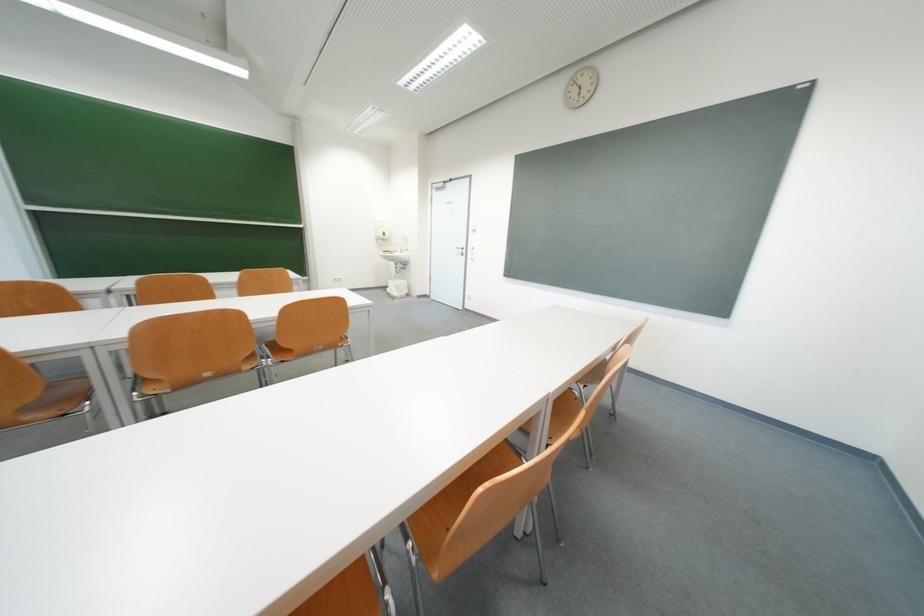
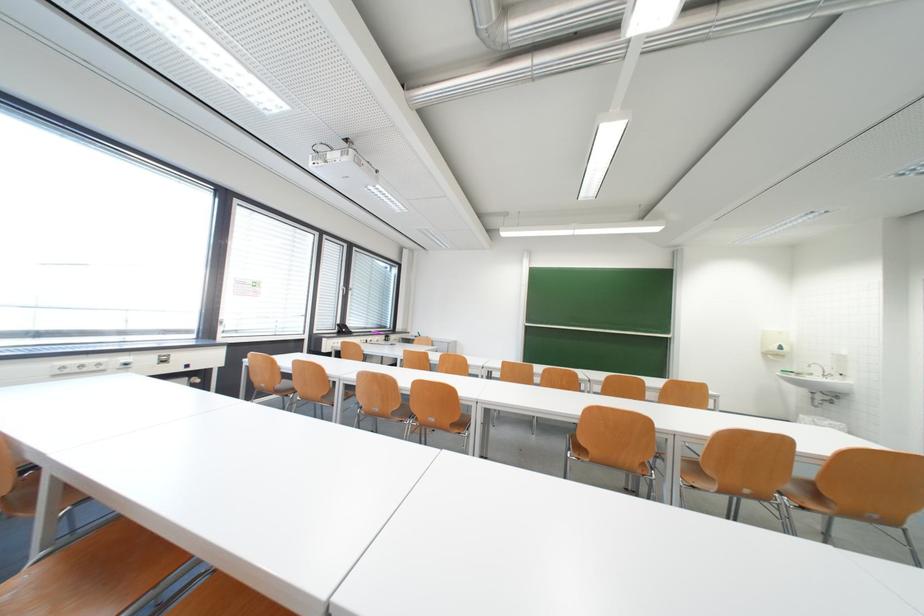
Find the pixel in the second image that matches (149,285) in the first image.

(616, 379)